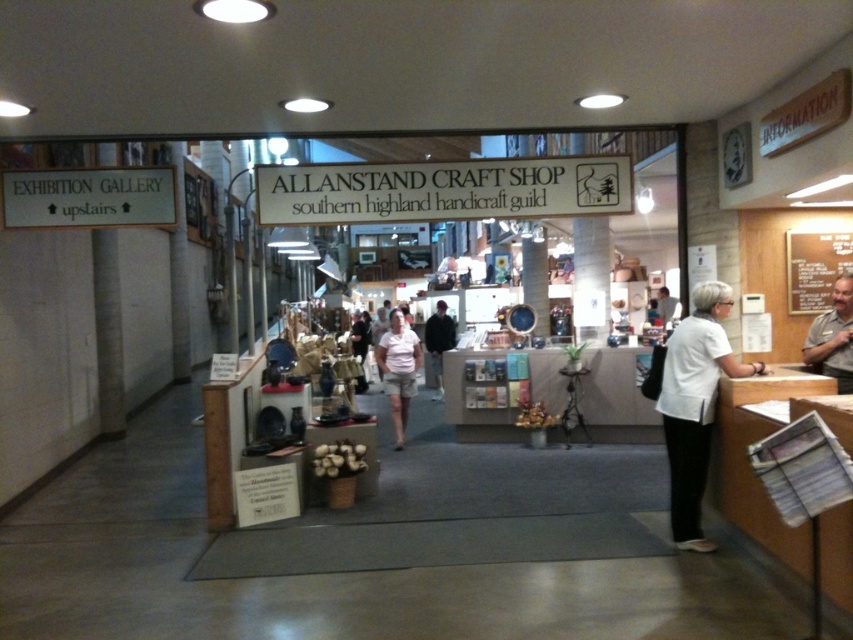
Question: Is gray fabric shirt at right bigger than pink fabric shirt at center?

Choices:
 (A) no
 (B) yes

Answer: (A)

Question: Is white fabric shirt at center smaller than pink fabric shirt at center?

Choices:
 (A) yes
 (B) no

Answer: (B)

Question: Is pink fabric shirt at center in front of black cotton shirt at center?

Choices:
 (A) yes
 (B) no

Answer: (A)

Question: Among these objects, which one is nearest to the camera?

Choices:
 (A) pink fabric shirt at center
 (B) gray fabric shirt at right
 (C) white fabric shirt at center

Answer: (C)

Question: Among these points, which one is farthest from the camera?

Choices:
 (A) (671, 515)
 (B) (445, 305)

Answer: (B)

Question: Which point is farther from the camera taking this photo?

Choices:
 (A) (694, 298)
 (B) (831, 356)
 (C) (398, 316)

Answer: (C)